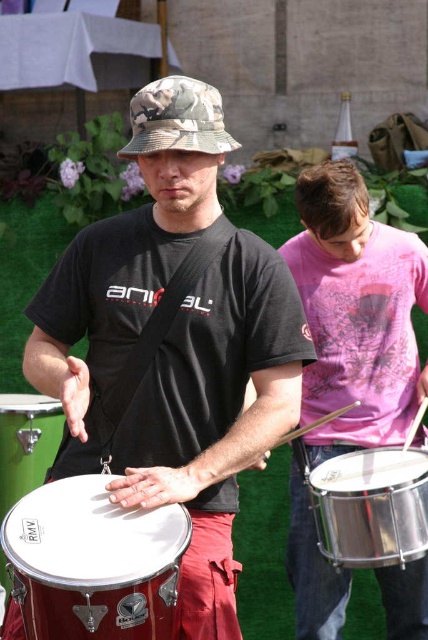
You are a stagehand setting up equipment for a performance. You have two drums, the metallic red drum at center and the shiny metallic drum at center. The stage has limited space, and you need to place them exactly 4 feet apart. Based on their current distance, should you move them closer or farther apart?

The metallic red drum at center is currently 3.73 feet away from the shiny metallic drum at center. Since the required distance is 4 feet, you should move them slightly farther apart to achieve the desired spacing.

You are a photographer setting up a tripod to capture the musical performance. The pink cotton shirt at right and the shiny metallic drum at center are both in your frame. Based on their sizes in the image, which object should you focus on first if you want to ensure both are in focus?

The pink cotton shirt at right is much taller than the shiny metallic drum at center, so focusing on the pink cotton shirt at right first would help ensure both are in focus since it is larger in the frame.

You are a photographer standing at the center of the scene. You want to capture a photo of the pink cotton shirt at right. According to the coordinates provided, in which direction should you move to frame the shirt properly?

The pink cotton shirt at right is located at coordinates point [356,314]. Since you are at the center, you should move to the right and upwards to align with the shirt.